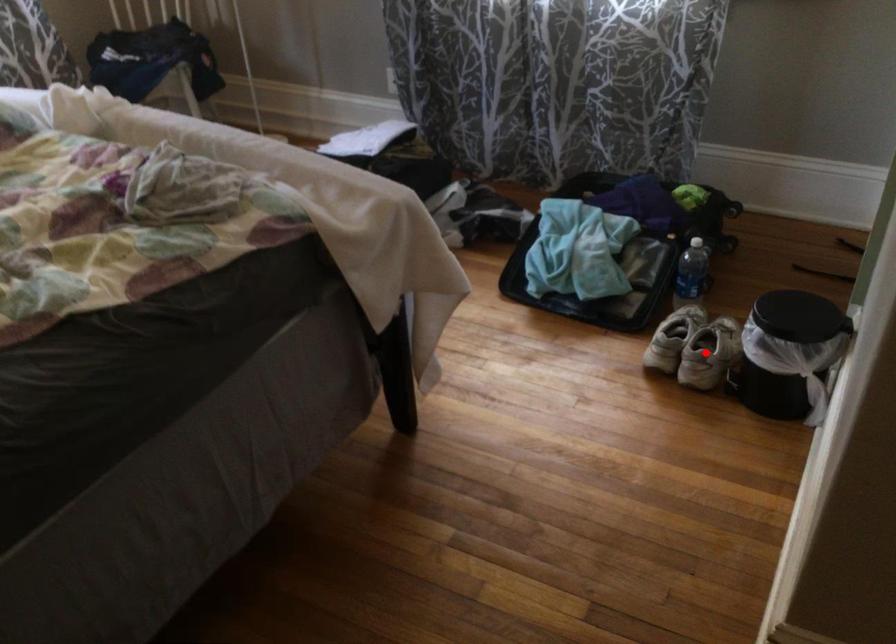
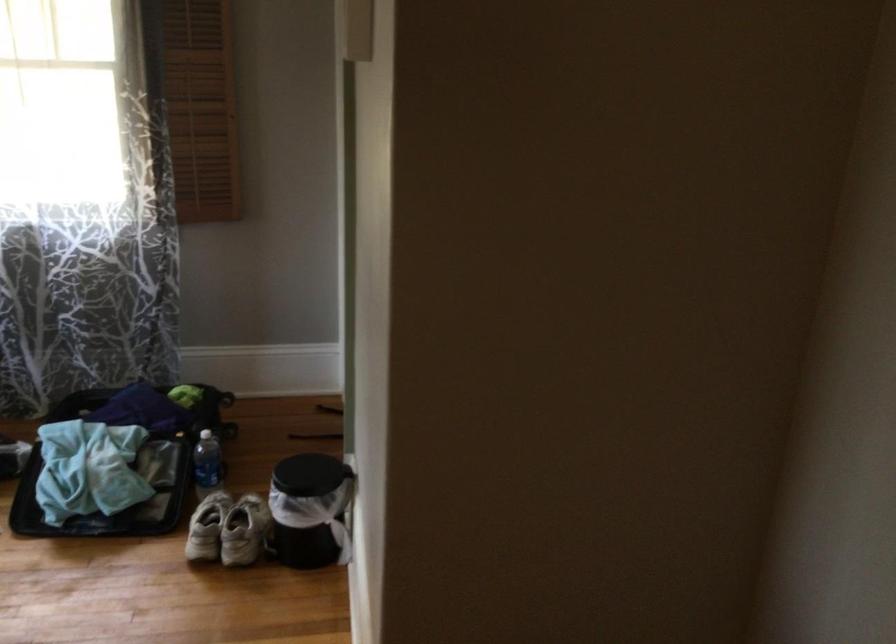
Question: I am providing you with two images of the same scene from different viewpoints. A red point is marked on the first image. Is the red point's position out of view in image 2?

Choices:
 (A) Yes
 (B) No

Answer: (B)